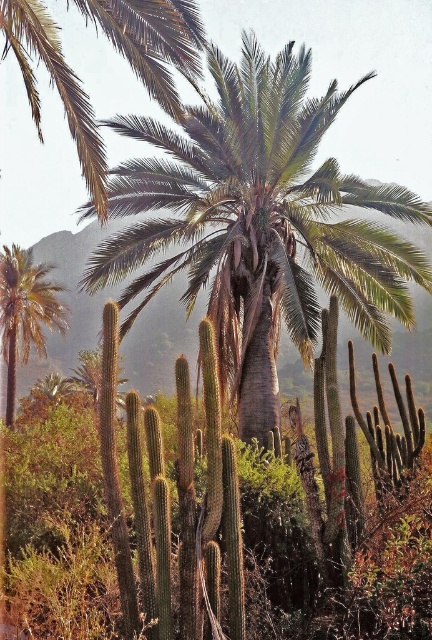
Question: Can you confirm if green leafy palm at center is positioned above green leafy palm at left?

Choices:
 (A) yes
 (B) no

Answer: (A)

Question: Estimate the real-world distances between objects in this image. Which object is closer to the green spiny cactus at center?

Choices:
 (A) green leafy palm at upper center
 (B) green leafy palm at left

Answer: (A)

Question: Is green spiny cactus at center positioned in front of green leafy palm at upper center?

Choices:
 (A) no
 (B) yes

Answer: (B)

Question: Estimate the real-world distances between objects in this image. Which object is closer to the green leafy palm at center?

Choices:
 (A) green leafy palm at upper center
 (B) green spiny cactus at center
 (C) green leafy palm at left

Answer: (A)

Question: Which object appears closest to the camera in this image?

Choices:
 (A) green leafy palm at center
 (B) green spiny cactus at center
 (C) green leafy palm at left
 (D) green leafy palm at upper center

Answer: (B)

Question: Can you confirm if green spiny cactus at center is positioned to the right of green leafy palm at upper center?

Choices:
 (A) yes
 (B) no

Answer: (A)